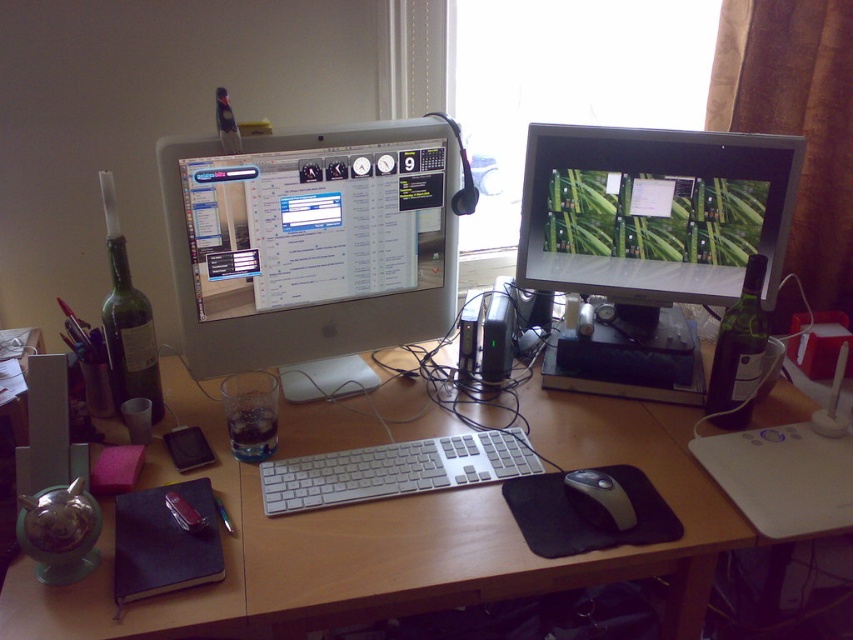
What is the object located at the coordinates point [312,241] on the desk?

The object located at point [312,241] is the satin silver monitor at center.

You are a photographer who needs to set up a tripod between the dark glass bottle at right and the camera. The tripod requires at least 1 meter of space between the two objects. Is there enough space for the tripod?

The dark glass bottle at right and camera are 1.24 meters apart, so yes, there is enough space for the tripod since 1.24 meters is greater than the required 1 meter.

You are setting up a new monitor for your home office. The matte black monitor at center needs to be placed on the wooden desk at center. Will the monitor fit on the desk based on their heights?

The wooden desk at center is shorter than the matte black monitor at center, so the monitor will not fit on the desk because it is taller than the desk.